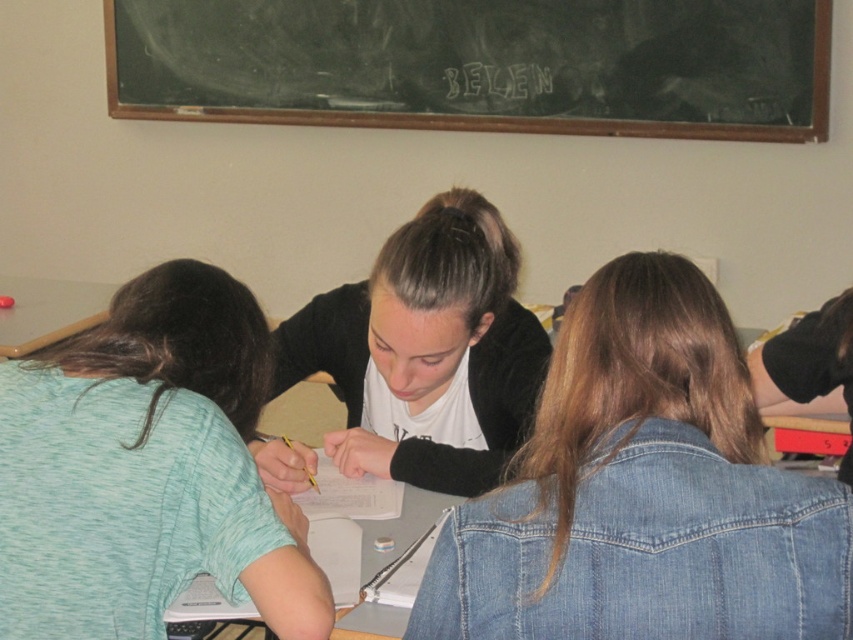
Question: Is white paper at center to the right of metallic gray table at left from the viewer's perspective?

Choices:
 (A) yes
 (B) no

Answer: (A)

Question: Among these objects, which one is farthest from the camera?

Choices:
 (A) white paper at center
 (B) black chalkboard at upper center

Answer: (B)

Question: Which point is closer to the camera?

Choices:
 (A) black chalk writing at upper center
 (B) teal fabric shirt at lower left

Answer: (B)

Question: Which object is closer to the camera taking this photo?

Choices:
 (A) teal fabric shirt at lower left
 (B) metallic gray table at left

Answer: (A)

Question: Is black matte shirt at center behind white paper at center?

Choices:
 (A) no
 (B) yes

Answer: (B)

Question: Does black chalkboard at upper center appear over black matte shirt at center?

Choices:
 (A) no
 (B) yes

Answer: (B)